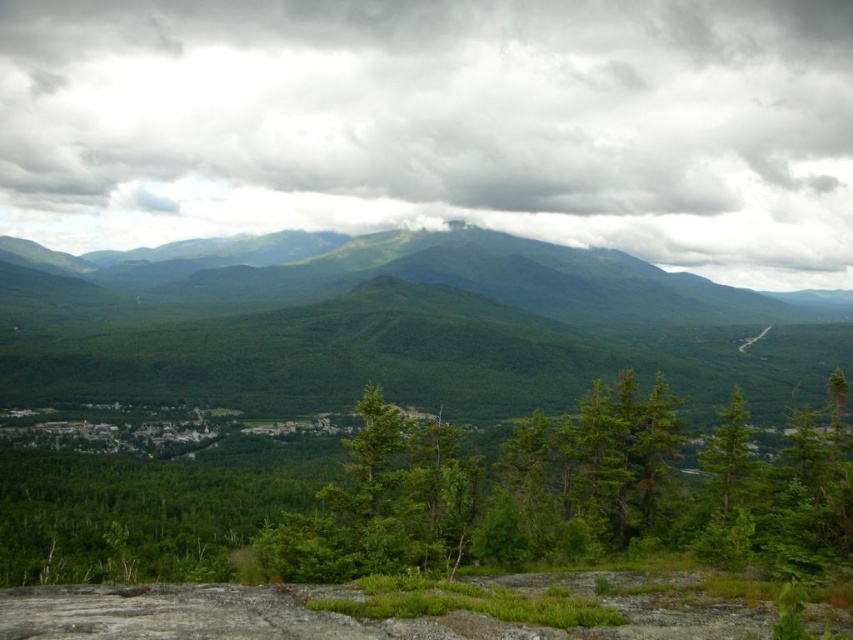
You are a photographer standing at the edge of the rocky outcrop in the foreground of the valley scene. You want to capture a shot of the point at coordinate (439, 124). Based on the scene description, where exactly in the image should you aim your camera?

The point at coordinate (439, 124) is located on the cloudy sky at upper center. To capture this point, aim your camera towards the upper center area of the image where the misty and cloudy sky is situated.